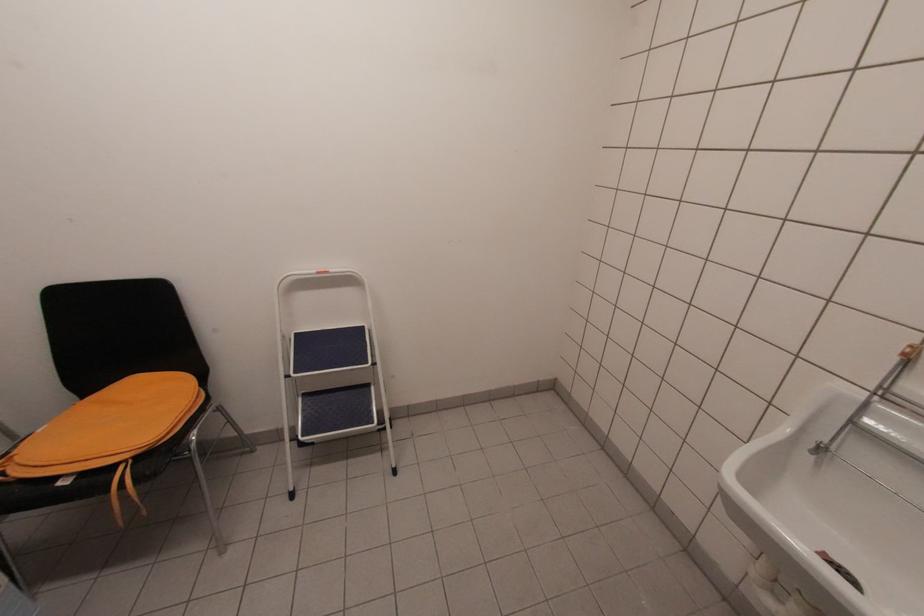
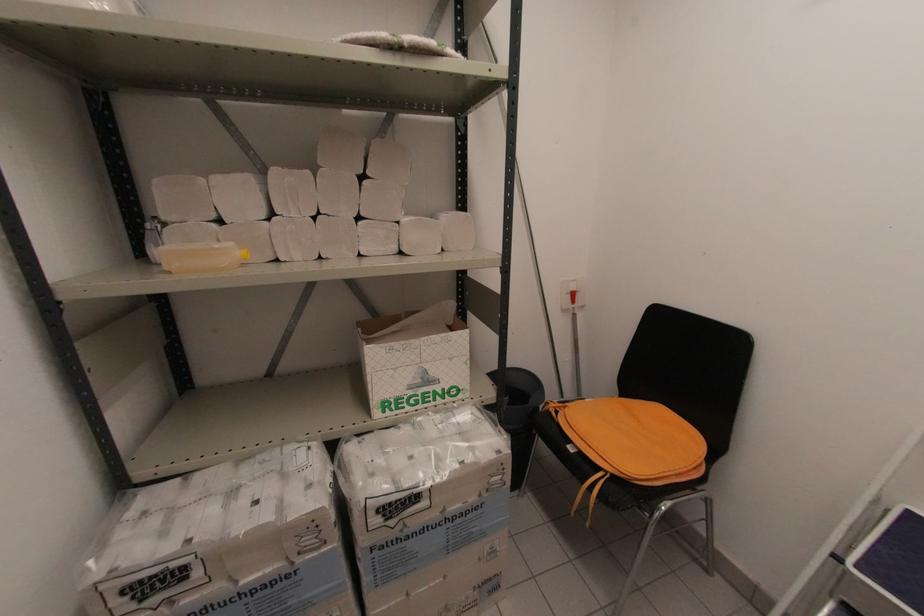
Question: The camera is either moving clockwise (left) or counter-clockwise (right) around the object. The first image is from the beginning of the video and the second image is from the end. Is the camera moving left or right when shooting the video?

Choices:
 (A) Left
 (B) Right

Answer: (B)